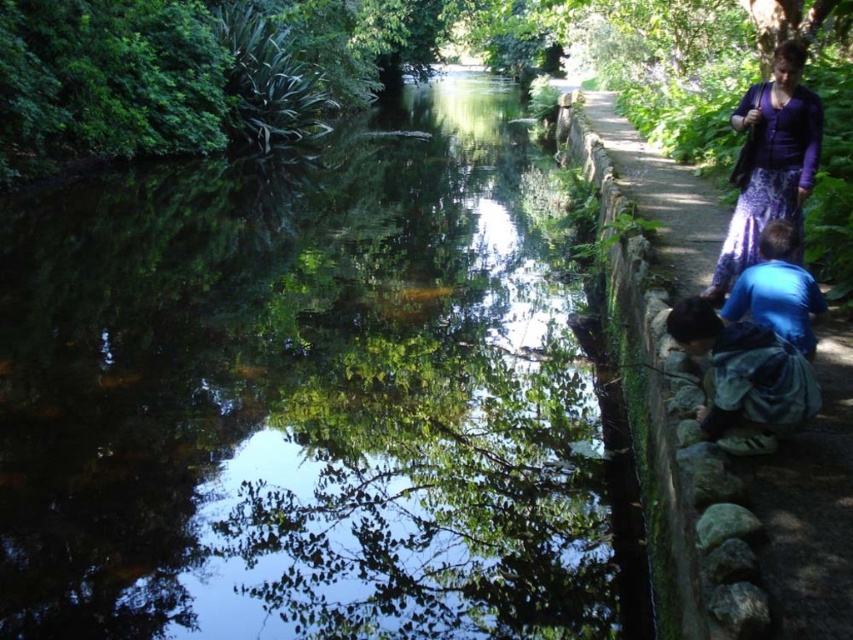
What do you see at coordinates (811, 506) in the screenshot? I see `green mossy stone path at right` at bounding box center [811, 506].

Find the location of a particular element. The image size is (853, 640). green mossy stone path at right is located at coordinates (811, 506).

You are a GUI agent. You are given a task and a screenshot of the screen. Output one action in this format:
    pyautogui.click(x=<x>, y=<y>)
    Task: Click on the green mossy stone path at right
    The height and width of the screenshot is (640, 853).
    Given the screenshot: What is the action you would take?
    pyautogui.click(x=811, y=506)

From the picture: Is purple fabric skirt at upper right to the right of blue matte shirt at lower right from the viewer's perspective?

Correct, you'll find purple fabric skirt at upper right to the right of blue matte shirt at lower right.

Based on the photo, does purple fabric skirt at upper right come in front of blue matte shirt at lower right?

That is False.

You are a GUI agent. You are given a task and a screenshot of the screen. Output one action in this format:
    pyautogui.click(x=<x>, y=<y>)
    Task: Click on the purple fabric skirt at upper right
    The image size is (853, 640).
    Given the screenshot: What is the action you would take?
    pyautogui.click(x=769, y=161)

This screenshot has height=640, width=853. I want to click on purple fabric skirt at upper right, so click(x=769, y=161).

Can you confirm if clear water at center is positioned to the right of green mossy stone path at right?

Incorrect, clear water at center is not on the right side of green mossy stone path at right.

Where is `clear water at center`? This screenshot has width=853, height=640. clear water at center is located at coordinates (310, 396).

This screenshot has width=853, height=640. Describe the element at coordinates (310, 396) in the screenshot. I see `clear water at center` at that location.

Where is `clear water at center`? This screenshot has width=853, height=640. clear water at center is located at coordinates (310, 396).